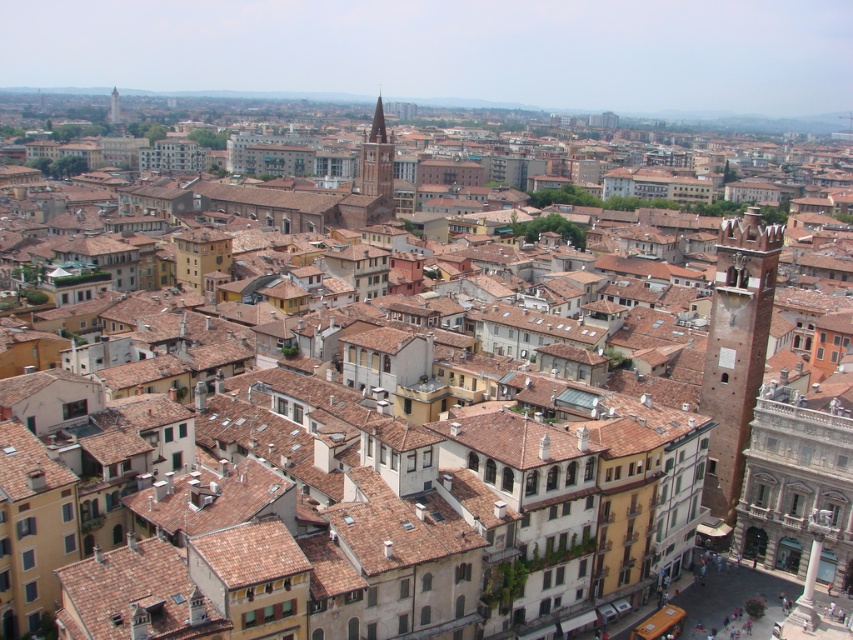
Question: Can you confirm if brick tower at right is smaller than smooth stone tower at center?

Choices:
 (A) no
 (B) yes

Answer: (B)

Question: Which object appears closest to the camera in this image?

Choices:
 (A) brick tower at right
 (B) light brown stone tower at upper center

Answer: (A)

Question: Which object appears closest to the camera in this image?

Choices:
 (A) light brown stone tower at upper center
 (B) brick tower at right
 (C) smooth stone tower at center

Answer: (B)

Question: Does brick tower at right come in front of smooth stone tower at center?

Choices:
 (A) no
 (B) yes

Answer: (B)

Question: Can you confirm if brick tower at right is positioned to the right of smooth stone tower at center?

Choices:
 (A) yes
 (B) no

Answer: (A)

Question: Which point appears closest to the camera in this image?

Choices:
 (A) (364, 192)
 (B) (728, 340)
 (C) (111, 104)

Answer: (B)